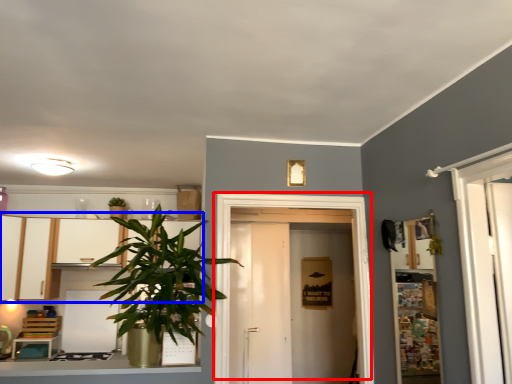
Question: Which point is further to the camera, door (highlighted by a red box) or dresser (highlighted by a blue box)?

Choices:
 (A) door
 (B) dresser

Answer: (A)